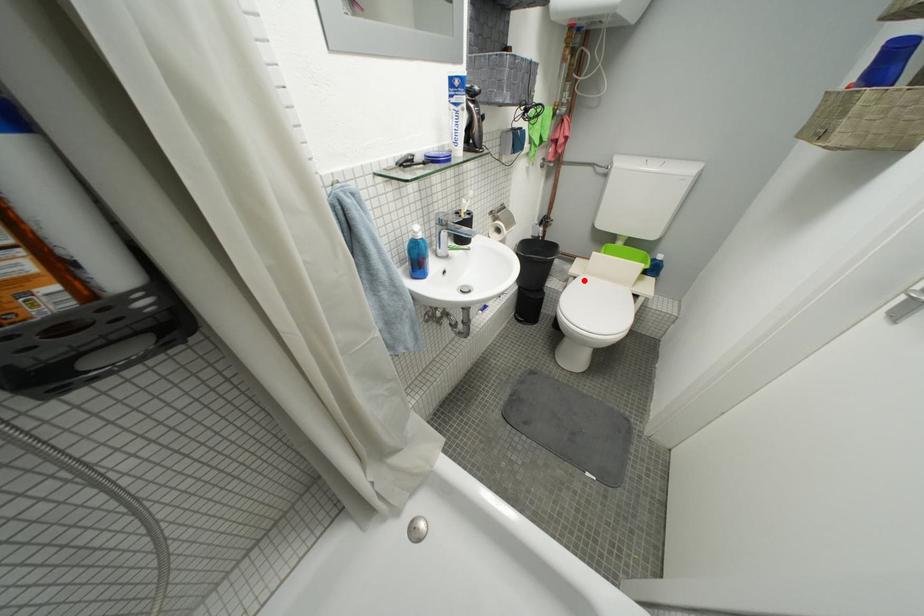
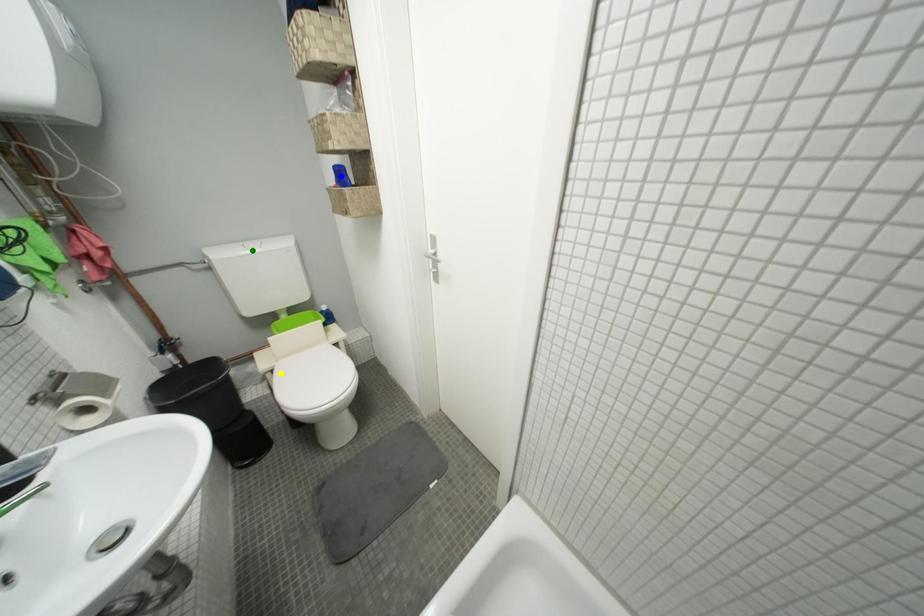
Question: I am providing you with two images of the same scene from different viewpoints. A red point is marked on the first image. You are given multiple points on the second image. Which spot in image 2 lines up with the point in image 1?

Choices:
 (A) yellow point
 (B) green point
 (C) blue point

Answer: (A)